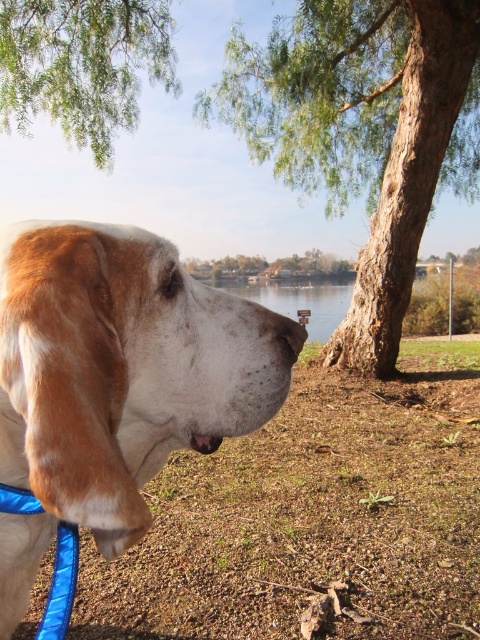
From the picture: Which is below, brown fur dog at left or green leafy tree at upper left?

brown fur dog at left is below.

Does brown fur dog at left come behind green leafy tree at upper left?

Result: No, brown fur dog at left is closer to the viewer.

The width and height of the screenshot is (480, 640). In order to click on brown fur dog at left in this screenshot , I will do `click(116, 381)`.

What are the coordinates of `brown fur dog at left` in the screenshot? It's located at (116, 381).

Is brown rough bark tree at upper center below green leafy tree at upper left?

Yes.

Can you confirm if brown rough bark tree at upper center is bigger than green leafy tree at upper left?

Correct, brown rough bark tree at upper center is larger in size than green leafy tree at upper left.

Describe the element at coordinates (363, 132) in the screenshot. I see `brown rough bark tree at upper center` at that location.

This screenshot has width=480, height=640. What are the coordinates of `brown rough bark tree at upper center` in the screenshot? It's located at (363, 132).

Can you confirm if brown fur dog at left is positioned above brown textured tree at center?

Actually, brown fur dog at left is below brown textured tree at center.

Which of these two, brown fur dog at left or brown textured tree at center, stands shorter?

With less height is brown fur dog at left.

The width and height of the screenshot is (480, 640). I want to click on brown fur dog at left, so click(x=116, y=381).

Image resolution: width=480 pixels, height=640 pixels. Identify the location of brown fur dog at left. (116, 381).